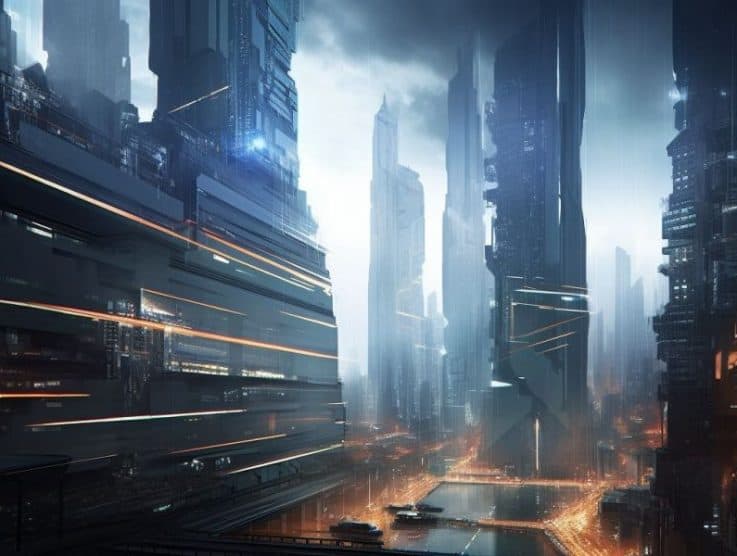
This screenshot has height=556, width=737. Find the location of `orange light`. orange light is located at coordinates (716, 366), (733, 359).